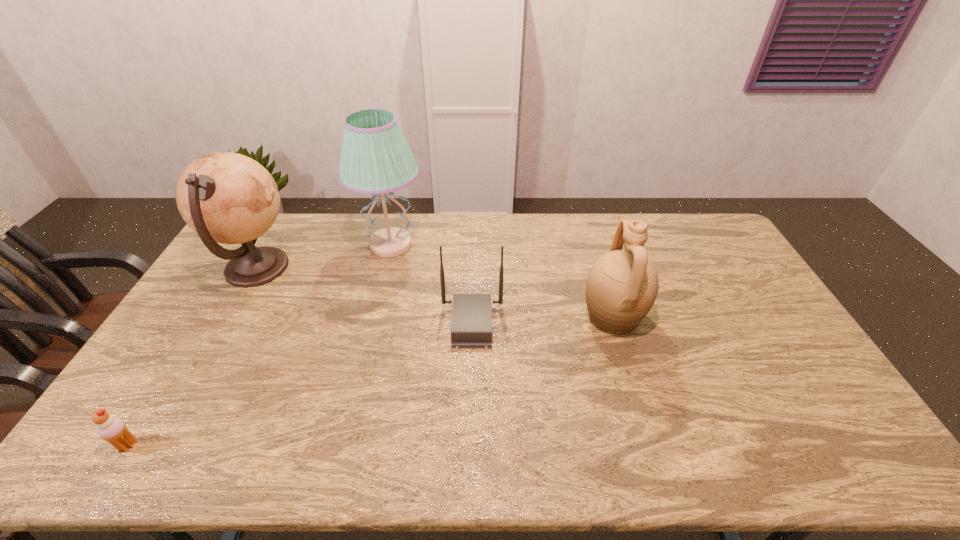
The image size is (960, 540). Identify the location of lamp. (375, 159).

Identify the location of globe. This screenshot has width=960, height=540. (225, 197).

At what (x,y) coordinates should I click in order to perform the action: click on the rightmost object. Please return your answer as a coordinate pair (x, y). This screenshot has width=960, height=540. Looking at the image, I should click on (622, 285).

The height and width of the screenshot is (540, 960). In order to click on the third shortest object in this screenshot , I will do `click(622, 285)`.

Find the location of a particular element. The height and width of the screenshot is (540, 960). the second shortest object is located at coordinates (471, 325).

Find the location of a particular element. This screenshot has width=960, height=540. router is located at coordinates (471, 325).

The image size is (960, 540). I want to click on the nearest object, so click(x=112, y=429).

At what (x,y) coordinates should I click in order to perform the action: click on the shortest object. Please return your answer as a coordinate pair (x, y). The width and height of the screenshot is (960, 540). Looking at the image, I should click on (112, 429).

Identify the location of free space located 0.330m on the right of the third object from left to right. The width and height of the screenshot is (960, 540). (514, 245).

This screenshot has height=540, width=960. In order to click on vacant space situated on the front-facing side of the globe in this screenshot , I will do `click(334, 268)`.